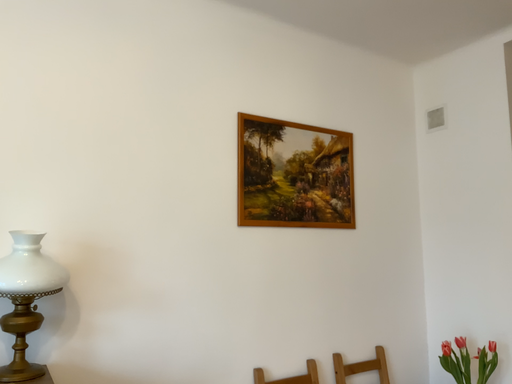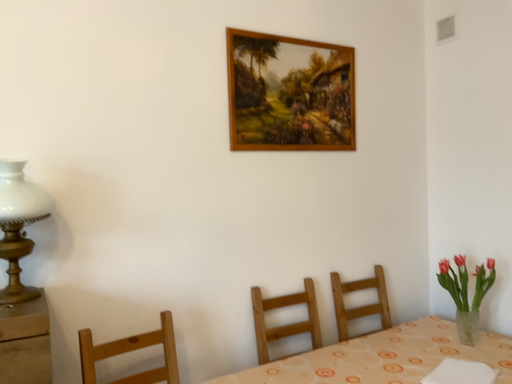
Question: Which way did the camera rotate in the video?

Choices:
 (A) rotated upward
 (B) rotated downward

Answer: (B)